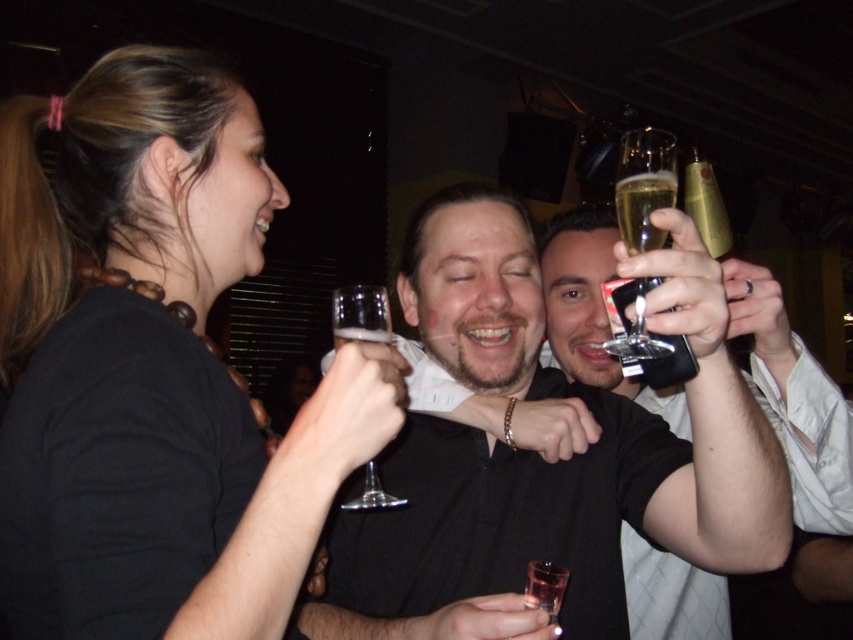
Is point (639, 172) positioned in front of point (660, 230)?

No, (639, 172) is further to viewer.

Is clear glass champagne flute at upper right closer to the viewer compared to translucent glass at upper right?

That is True.

Find the location of `clear glass champagne flute at upper right`. clear glass champagne flute at upper right is located at coordinates point(643,186).

At what (x,y) coordinates should I click in order to perform the action: click on clear glass champagne flute at upper right. Please return your answer as a coordinate pair (x, y). Looking at the image, I should click on (643, 186).

Between translucent glass at upper right and gold metallic bottle at upper right, which one appears on the right side from the viewer's perspective?

gold metallic bottle at upper right is more to the right.

Is point (643, 250) in front of point (706, 214)?

That is True.

Identify the location of translucent glass at upper right. This screenshot has height=640, width=853. (643, 208).

Is matte black shirt at upper left smaller than shiny black shirt at center?

Indeed, matte black shirt at upper left has a smaller size compared to shiny black shirt at center.

Is matte black shirt at upper left below shiny black shirt at center?

No.

Does point (38, 120) come in front of point (509, 538)?

Yes.

Locate an element on the screen. matte black shirt at upper left is located at coordinates (151, 369).